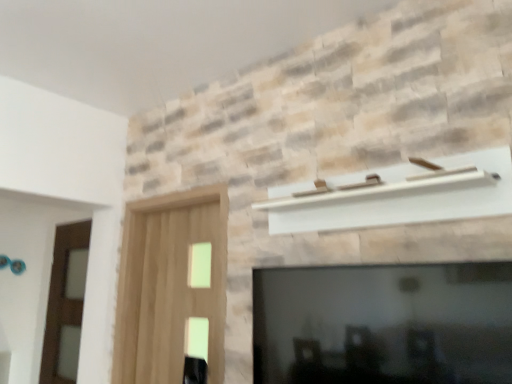
Question: From the image's perspective, does brown wooden screen door at left, the second screen door viewed from the right, appear lower than black glass fireplace at lower center?

Choices:
 (A) yes
 (B) no

Answer: (A)

Question: Considering the relative sizes of brown wooden screen door at left, the second screen door viewed from the right, and black glass fireplace at lower center in the image provided, is brown wooden screen door at left, the second screen door viewed from the right, wider than black glass fireplace at lower center?

Choices:
 (A) no
 (B) yes

Answer: (B)

Question: Is brown wooden screen door at left, the second screen door viewed from the right, turned away from black glass fireplace at lower center?

Choices:
 (A) no
 (B) yes

Answer: (A)

Question: Is brown wooden screen door at left, which is the first screen door in left-to-right order, positioned in front of black glass fireplace at lower center?

Choices:
 (A) no
 (B) yes

Answer: (A)

Question: Considering the relative sizes of brown wooden screen door at left, the second screen door viewed from the right, and black glass fireplace at lower center in the image provided, is brown wooden screen door at left, the second screen door viewed from the right, bigger than black glass fireplace at lower center?

Choices:
 (A) no
 (B) yes

Answer: (B)

Question: Do you think brown wooden screen door at left, which is the 2th screen door from front to back, is within black glass fireplace at lower center, or outside of it?

Choices:
 (A) outside
 (B) inside

Answer: (A)

Question: From the image's perspective, is brown wooden screen door at left, the second screen door viewed from the right, positioned above or below black glass fireplace at lower center?

Choices:
 (A) below
 (B) above

Answer: (A)

Question: Considering the positions of brown wooden screen door at left, the second screen door viewed from the right, and black glass fireplace at lower center in the image, is brown wooden screen door at left, the second screen door viewed from the right, taller or shorter than black glass fireplace at lower center?

Choices:
 (A) short
 (B) tall

Answer: (B)

Question: Relative to black glass fireplace at lower center, is brown wooden screen door at left, which is the 2th screen door from front to back, in front or behind?

Choices:
 (A) behind
 (B) front

Answer: (A)

Question: Looking at the image, does black glass fireplace at lower center seem bigger or smaller compared to brown wooden screen door at left, which is the 1th screen door in back-to-front order?

Choices:
 (A) big
 (B) small

Answer: (B)

Question: In terms of width, does black glass fireplace at lower center look wider or thinner when compared to brown wooden screen door at left, which is the 1th screen door in back-to-front order?

Choices:
 (A) wide
 (B) thin

Answer: (B)

Question: Is black glass fireplace at lower center taller or shorter than brown wooden screen door at left, the second screen door viewed from the right?

Choices:
 (A) short
 (B) tall

Answer: (A)

Question: Is black glass fireplace at lower center to the left or to the right of brown wooden screen door at left, which is the first screen door in left-to-right order, in the image?

Choices:
 (A) right
 (B) left

Answer: (A)

Question: Visually, is light brown wood screen door at left, marked as the 1th screen door in a right-to-left arrangement, positioned to the left or to the right of brown wooden screen door at left, which is the 1th screen door in back-to-front order?

Choices:
 (A) left
 (B) right

Answer: (B)

Question: Looking at their shapes, would you say light brown wood screen door at left, which is counted as the first screen door, starting from the front, is wider or thinner than brown wooden screen door at left, the second screen door viewed from the right?

Choices:
 (A) wide
 (B) thin

Answer: (A)